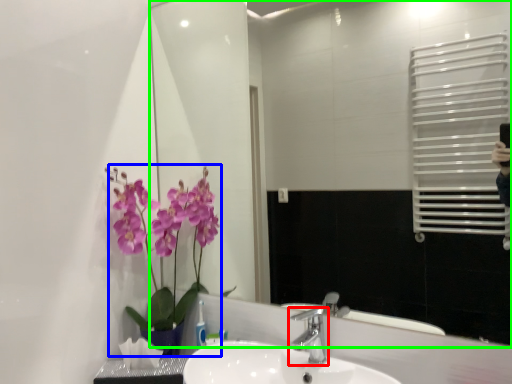
Question: Based on their relative distances, which object is farther from tap (highlighted by a red box)? Choose from floral arrangement (highlighted by a blue box) and mirror (highlighted by a green box).

Choices:
 (A) floral arrangement
 (B) mirror

Answer: (B)